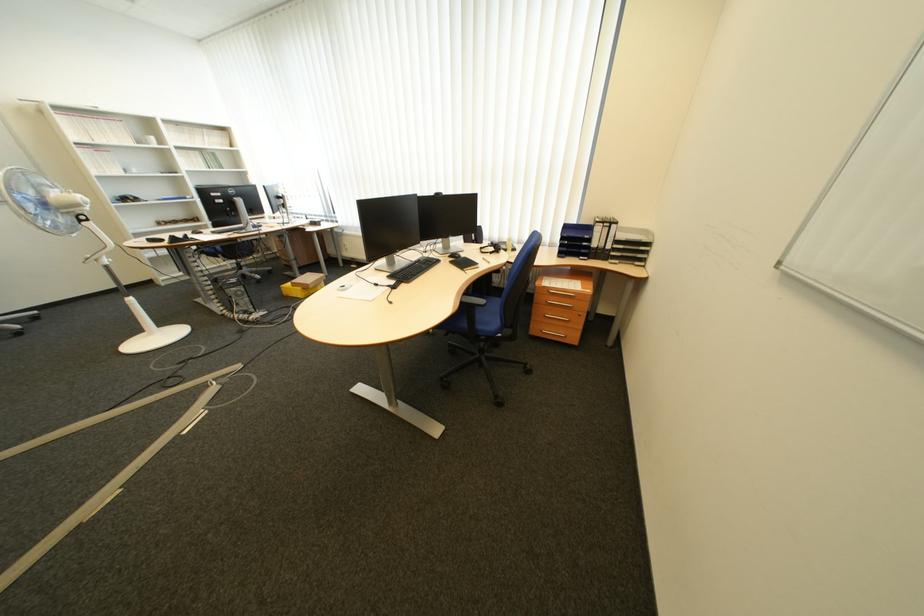
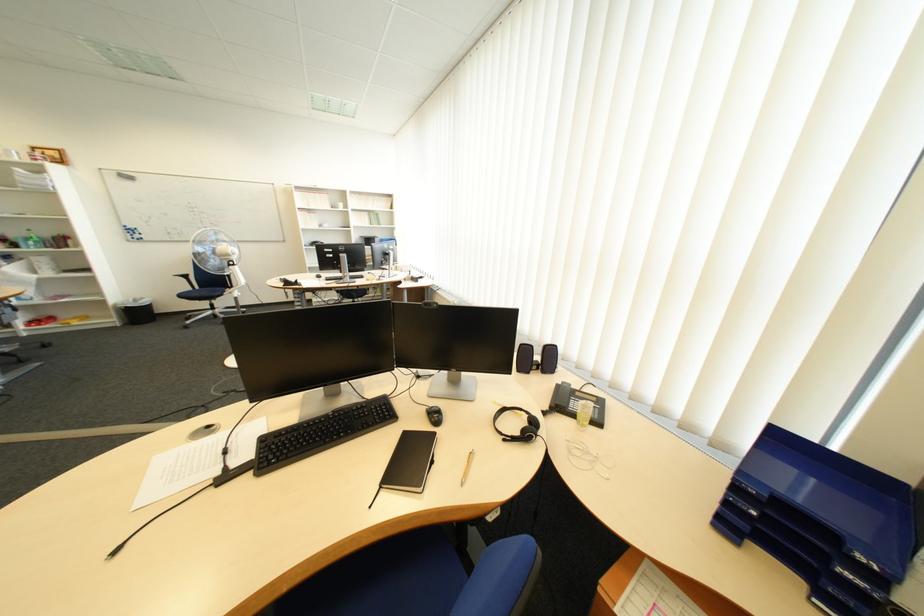
In the second image, find the point that corresponds to (564,246) in the first image.

(730, 446)